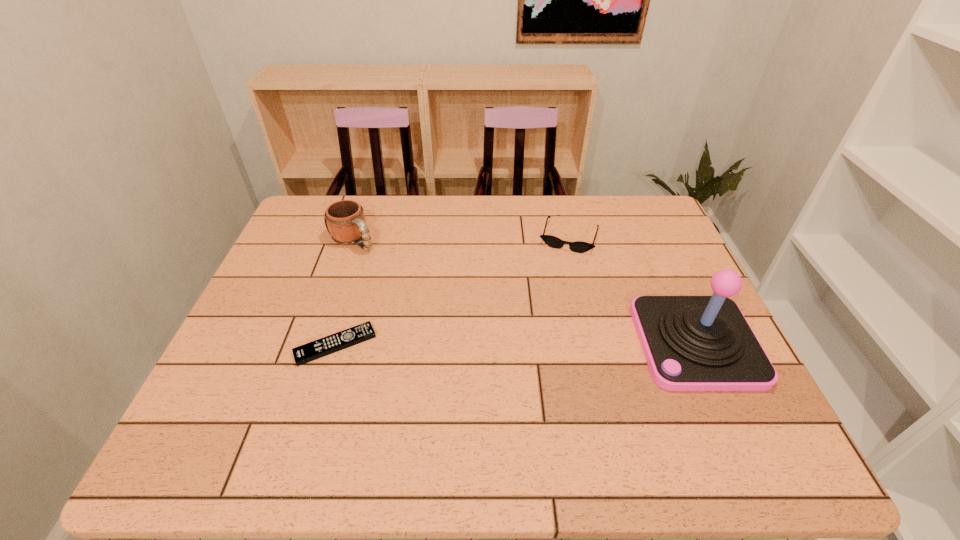
Locate which object ranks in proximity to the second shortest object. Please provide its 2D coordinates. Your answer should be formatted as a tuple, i.e. [(x, y)], where the tuple contains the x and y coordinates of a point satisfying the conditions above.

[(691, 343)]

At what (x,y) coordinates should I click in order to perform the action: click on free spot that satisfies the following two spatial constraints: 1. on the back side of the third tallest object; 2. on the right side of the remote control. Please return your answer as a coordinate pair (x, y). The image size is (960, 540). Looking at the image, I should click on (368, 237).

This screenshot has height=540, width=960. I want to click on vacant position in the image that satisfies the following two spatial constraints: 1. on the back side of the tallest object; 2. forward from the base of the remote control, so click(x=336, y=342).

Where is `free space that satisfies the following two spatial constraints: 1. on the front side of the remote control; 2. on the left side of the mug`? The image size is (960, 540). free space that satisfies the following two spatial constraints: 1. on the front side of the remote control; 2. on the left side of the mug is located at coordinates (318, 345).

Identify the location of free point that satisfies the following two spatial constraints: 1. on the back side of the remote control; 2. on the left side of the third tallest object. (368, 237).

Identify the location of blank area in the image that satisfies the following two spatial constraints: 1. on the back side of the joystick; 2. forward from the base of the remote control. (336, 342).